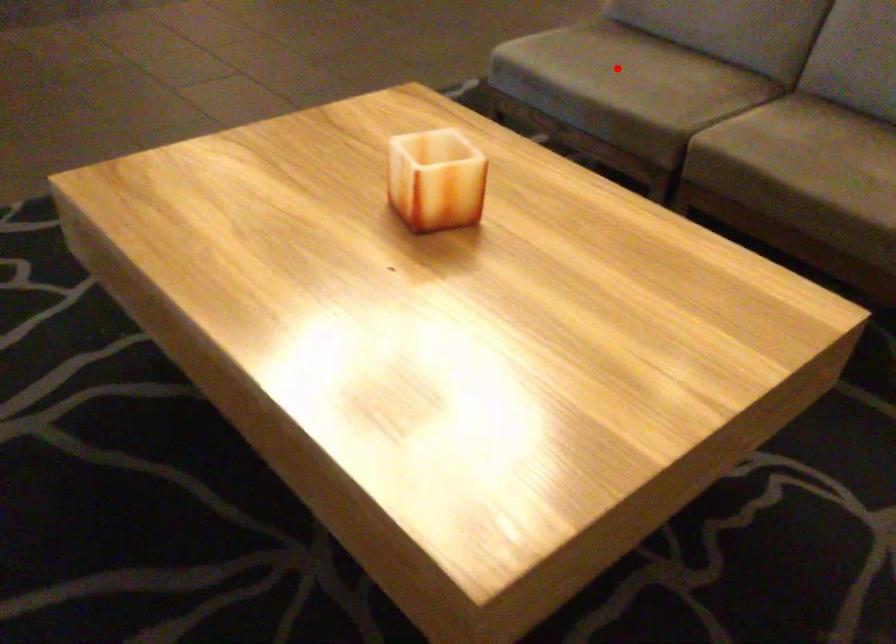
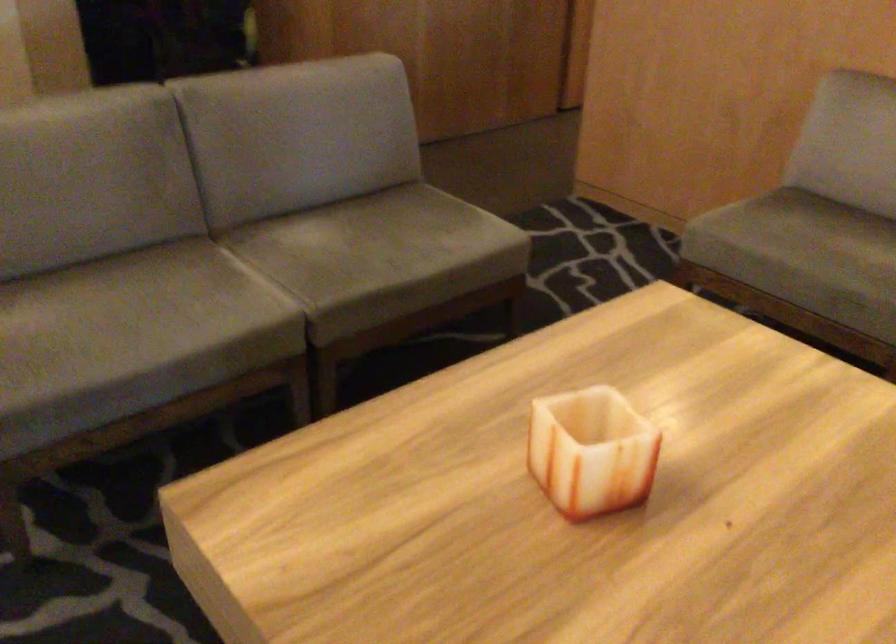
Question: I am providing you with two images of the same scene from different viewpoints. In image1, a red point is highlighted. Considering the same 3D point in image2, which of the following is correct?

Choices:
 (A) It is closer
 (B) It is farther

Answer: (A)